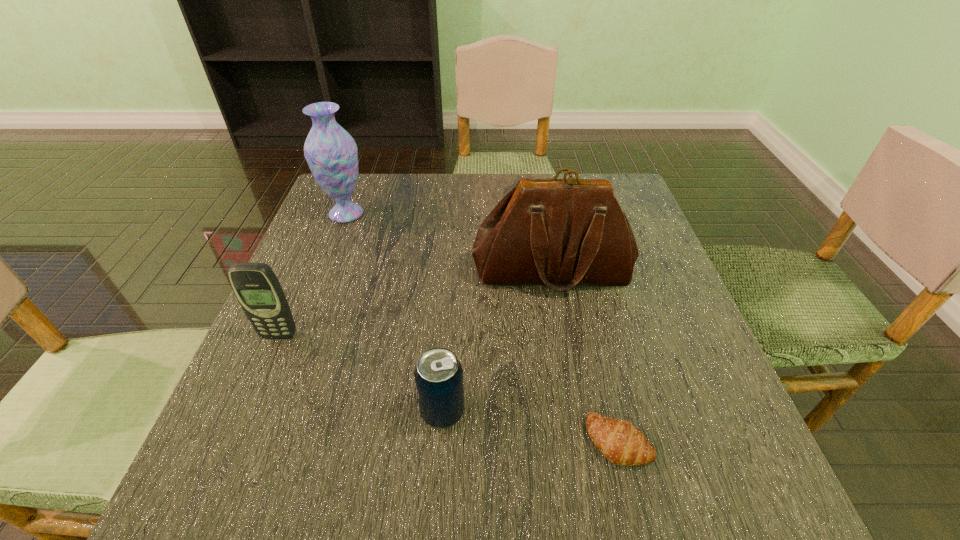
Where is `vase`? This screenshot has height=540, width=960. vase is located at coordinates (331, 152).

I want to click on shoulder bag, so click(x=561, y=233).

Where is `cellular telephone`? cellular telephone is located at coordinates (256, 287).

The width and height of the screenshot is (960, 540). In order to click on the third shortest object in this screenshot , I will do `click(256, 287)`.

Find the location of a particular element. The image size is (960, 540). the second shortest object is located at coordinates (438, 374).

Identify the location of the third object from right to left. (438, 374).

Identify the location of crescent roll. (620, 442).

The height and width of the screenshot is (540, 960). I want to click on blank area located 0.380m on the right of the farthest object, so click(518, 214).

Find the location of `free space located 0.160m on the front of the second farthest object`. free space located 0.160m on the front of the second farthest object is located at coordinates (568, 363).

Locate an element on the screen. This screenshot has height=540, width=960. vacant space located on the screen of the cellular telephone is located at coordinates (232, 447).